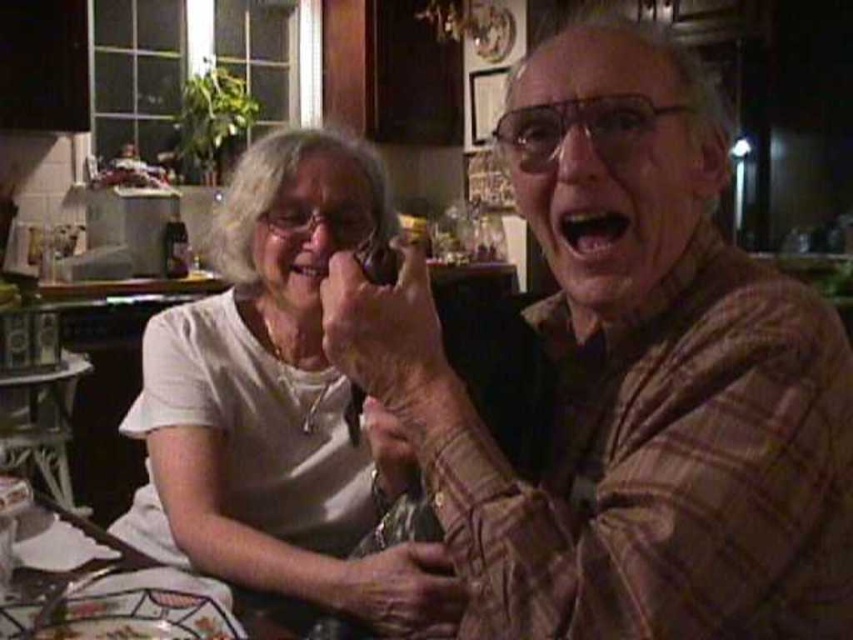
Question: Which point appears closest to the camera in this image?

Choices:
 (A) (126, 627)
 (B) (821, 467)
 (C) (215, 637)
 (D) (271, 422)

Answer: (B)

Question: Which point is farther to the camera?

Choices:
 (A) white glossy plate at lower left
 (B) white matte shirt at upper left
 (C) brown plaid shirt at center
 (D) decorative ceramic platter at lower left

Answer: (B)

Question: Which point appears closest to the camera in this image?

Choices:
 (A) (59, 624)
 (B) (263, 284)
 (C) (99, 589)
 (D) (643, 522)

Answer: (D)

Question: Does white matte shirt at upper left appear over white glossy plate at lower left?

Choices:
 (A) no
 (B) yes

Answer: (B)

Question: Is brown plaid shirt at center wider than white glossy plate at lower left?

Choices:
 (A) no
 (B) yes

Answer: (B)

Question: Considering the relative positions of white glossy plate at lower left and decorative ceramic platter at lower left in the image provided, where is white glossy plate at lower left located with respect to decorative ceramic platter at lower left?

Choices:
 (A) below
 (B) above

Answer: (B)